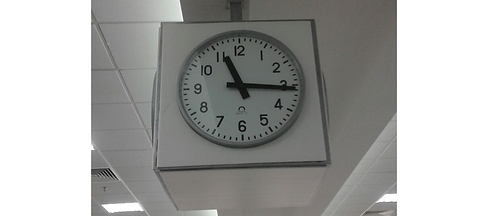
What are the coordinates of `clock` in the screenshot? It's located at (222, 109).